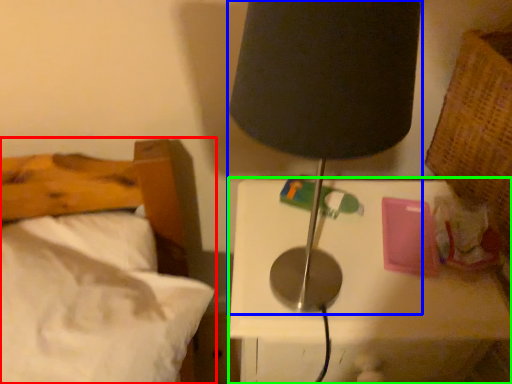
Question: Considering the real-world distances, which object is closest to bed (highlighted by a red box)? lamp (highlighted by a blue box) or nightstand (highlighted by a green box).

Choices:
 (A) lamp
 (B) nightstand

Answer: (B)